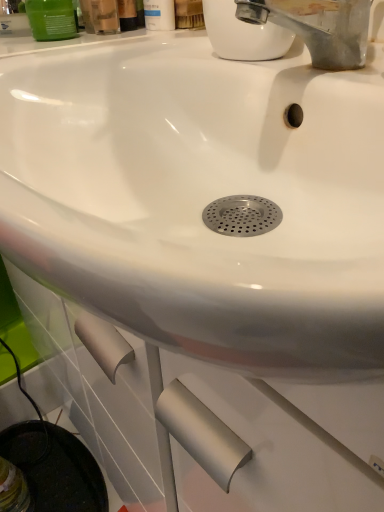
Where is `space that is in front of white matte bottle at upper center, the 1th mouthwash when ordered from right to left`? space that is in front of white matte bottle at upper center, the 1th mouthwash when ordered from right to left is located at coordinates pos(158,50).